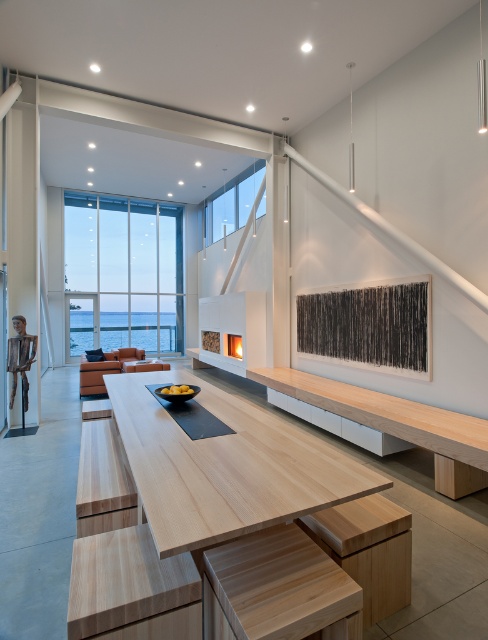
Is light brown wood stool at lower center shorter than matte white fireplace at center?

No.

Does point (385, 554) come closer to viewer compared to point (234, 333)?

That is True.

Which is behind, point (368, 584) or point (239, 342)?

The point (239, 342) is more distant.

I want to click on light brown wood stool at lower center, so click(x=367, y=548).

Based on the photo, is light wood table at center bigger than light brown wood stool at lower center?

Correct, light wood table at center is larger in size than light brown wood stool at lower center.

Can you confirm if light wood table at center is wider than light brown wood stool at lower center?

Indeed, light wood table at center has a greater width compared to light brown wood stool at lower center.

Who is more distant from viewer, (x=208, y=394) or (x=346, y=528)?

Positioned behind is point (x=208, y=394).

Where is `light wood table at center`? The width and height of the screenshot is (488, 640). light wood table at center is located at coordinates (224, 467).

Identify the location of light wood table at center. (224, 467).

Which is in front, point (148, 452) or point (242, 353)?

Point (148, 452)

Where is `light wood table at center`? The width and height of the screenshot is (488, 640). light wood table at center is located at coordinates (224, 467).